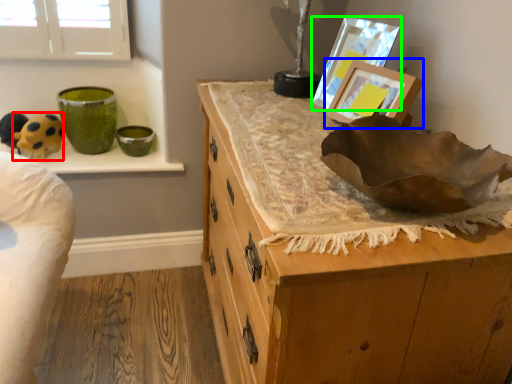
Question: Which is farther away from animal (highlighted by a red box)? picture frame (highlighted by a blue box) or picture frame (highlighted by a green box)?

Choices:
 (A) picture frame
 (B) picture frame

Answer: (A)